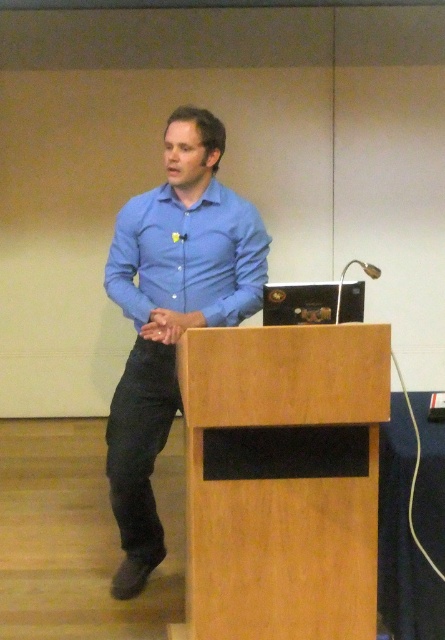
You are sitting in the front row of the conference room and notice two points on the podium. The first point is at coordinates point (254, 452) and the second is at point (194, 260). Which point is closer to you?

Point (254, 452) is closer to the viewer than point (194, 260).

You are sitting in the audience of the conference room and want to see both the blue cotton shirt at center and the matte blue shirt at center clearly. Which one appears closer to you?

The blue cotton shirt at center appears closer to you because it is further to the viewer than the matte blue shirt at center.